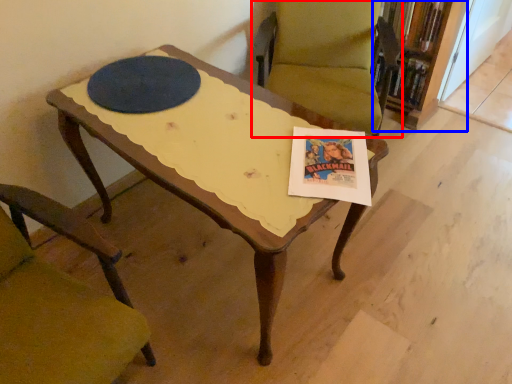
Question: Which of the following is the closest to the observer, chair (highlighted by a red box) or bookcase (highlighted by a blue box)?

Choices:
 (A) chair
 (B) bookcase

Answer: (A)